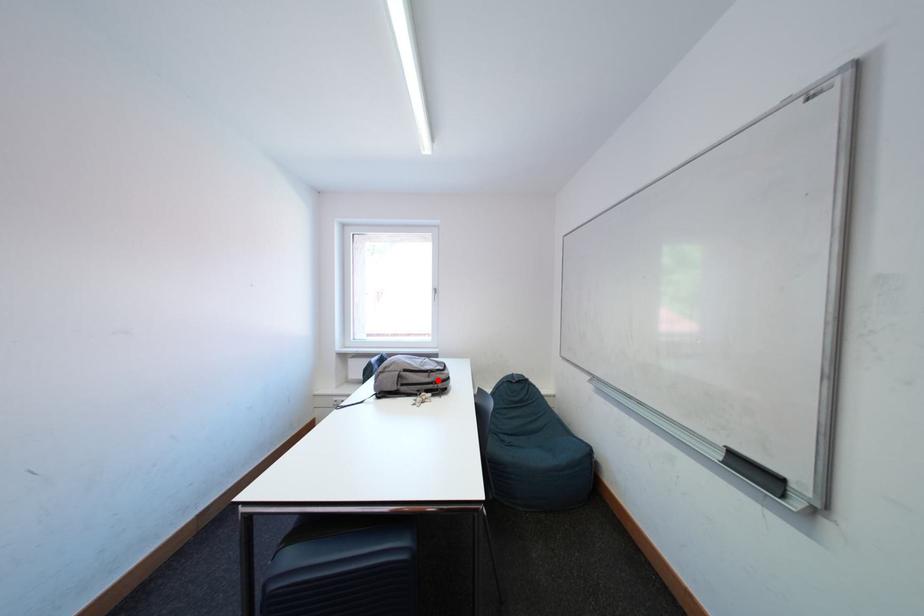
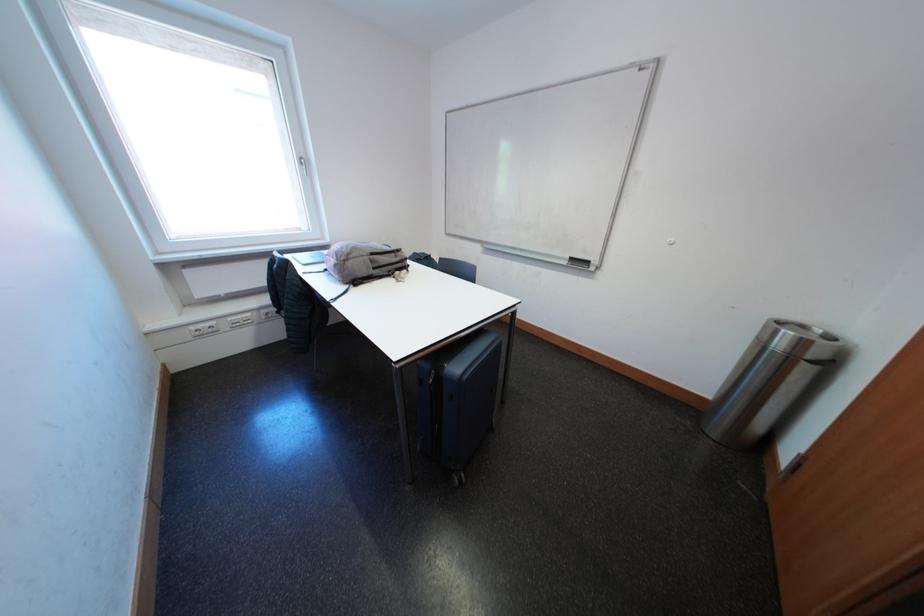
Find the pixel in the second image that matches the highlighted location in the first image.

(406, 261)